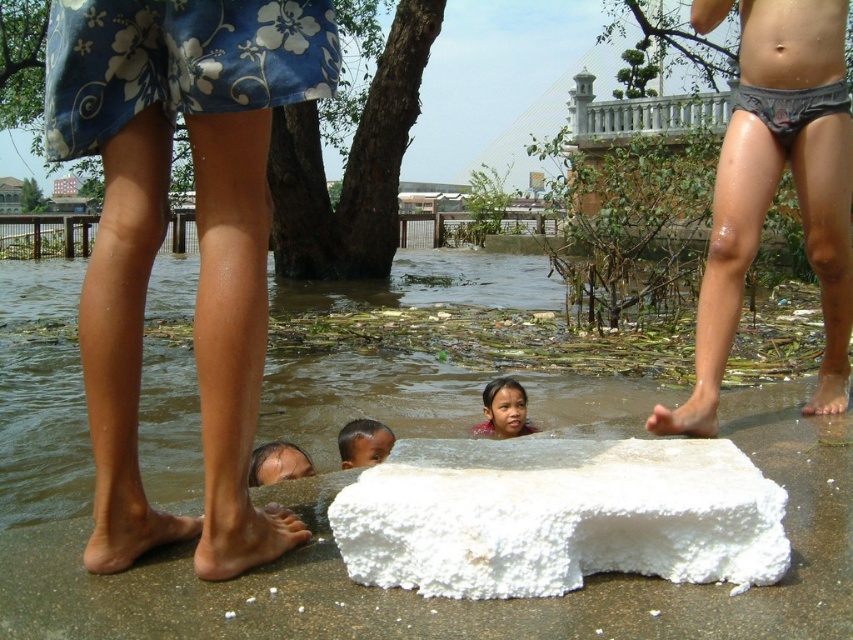
Question: Does smooth skin boy at lower center appear on the right side of white foam block at lower right?

Choices:
 (A) no
 (B) yes

Answer: (A)

Question: Is white foam block at center above smooth skin boy at lower center?

Choices:
 (A) yes
 (B) no

Answer: (A)

Question: Which point is closer to the camera?

Choices:
 (A) white foam block at lower right
 (B) white foam block at center
 (C) white foam foot at lower center

Answer: (B)

Question: Is white foam foot at lower center positioned in front of smooth skin child at center?

Choices:
 (A) no
 (B) yes

Answer: (B)

Question: Considering the real-world distances, which object is farthest from the white foam block at center?

Choices:
 (A) dry skin foot at lower center
 (B) smooth skin boy at lower center

Answer: (B)

Question: Which object is positioned farthest from the gray fabric shorts at right?

Choices:
 (A) smooth skin boy at lower center
 (B) white foam foot at lower center
 (C) dry skin foot at lower center
 (D) blue floral fabric shorts at lower left

Answer: (C)